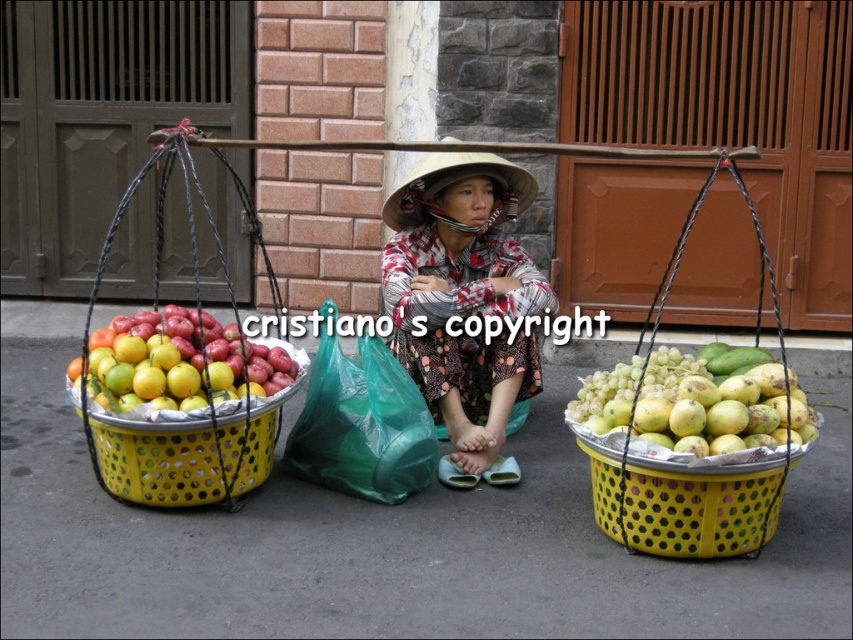
Question: Estimate the real-world distances between objects in this image. Which object is closer to the plaid fabric hat at center?

Choices:
 (A) green matte grapes at right
 (B) green plastic bag at center

Answer: (B)

Question: Can you confirm if plaid fabric hat at center is thinner than yellow plastic basket at left?

Choices:
 (A) yes
 (B) no

Answer: (A)

Question: Estimate the real-world distances between objects in this image. Which object is farther from the shiny metallic apples at left?

Choices:
 (A) straw hat at center
 (B) green matte grapes at right
 (C) yellow plastic basket at left

Answer: (B)

Question: Observing the image, what is the correct spatial positioning of shiny metallic apples at left in reference to straw hat at center?

Choices:
 (A) left
 (B) right

Answer: (A)

Question: Which point is closer to the camera?

Choices:
 (A) (x=415, y=392)
 (B) (x=416, y=253)
 (C) (x=408, y=188)
 (D) (x=675, y=376)

Answer: (D)

Question: Observing the image, what is the correct spatial positioning of yellow plastic basket at left in reference to shiny metallic apples at left?

Choices:
 (A) below
 (B) above

Answer: (A)